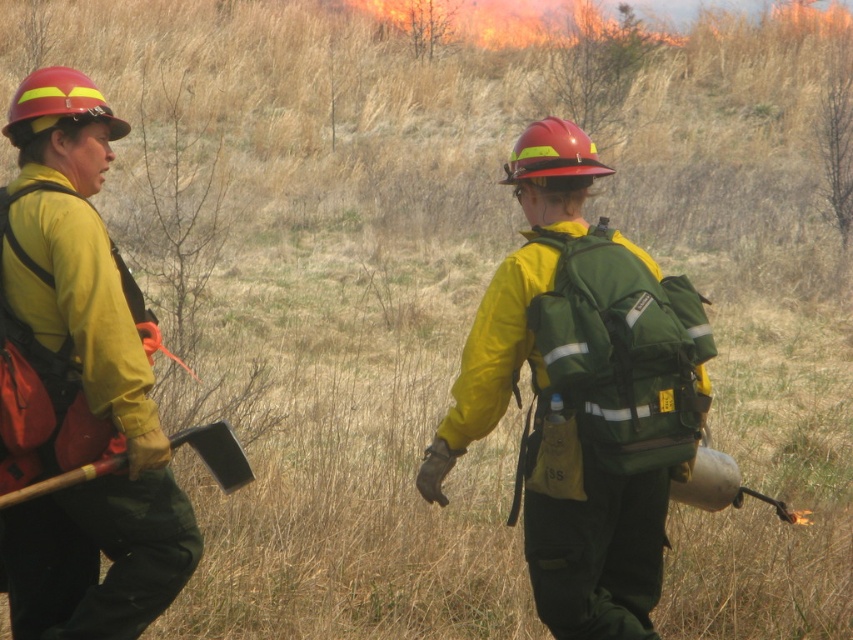
Question: Based on their relative distances, which object is nearer to the green fabric backpack at center?

Choices:
 (A) matte yellow jacket at left
 (B) wooden handle axe at left

Answer: (B)

Question: Can you confirm if matte yellow jacket at left is wider than wooden handle axe at left?

Choices:
 (A) yes
 (B) no

Answer: (B)

Question: Which is farther from the matte yellow jacket at left?

Choices:
 (A) wooden handle axe at left
 (B) green fabric backpack at center

Answer: (B)

Question: Which object is the closest to the green fabric backpack at center?

Choices:
 (A) matte yellow jacket at left
 (B) wooden handle axe at left

Answer: (B)

Question: Does green fabric backpack at center appear over wooden handle axe at left?

Choices:
 (A) yes
 (B) no

Answer: (A)

Question: Considering the relative positions of matte yellow jacket at left and wooden handle axe at left in the image provided, where is matte yellow jacket at left located with respect to wooden handle axe at left?

Choices:
 (A) left
 (B) right

Answer: (A)